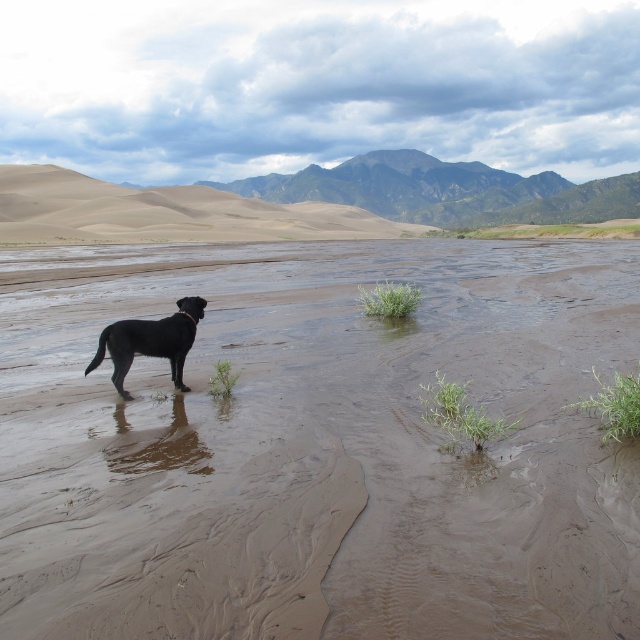
Is brown sandy mud at center bigger than black glossy dog at center?

Yes.

How far apart are brown sandy mud at center and black glossy dog at center?

They are 10.60 feet apart.

Which is in front, point (372, 324) or point (150, 330)?

Point (150, 330) is more forward.

Find the location of a particular element. brown sandy mud at center is located at coordinates (317, 445).